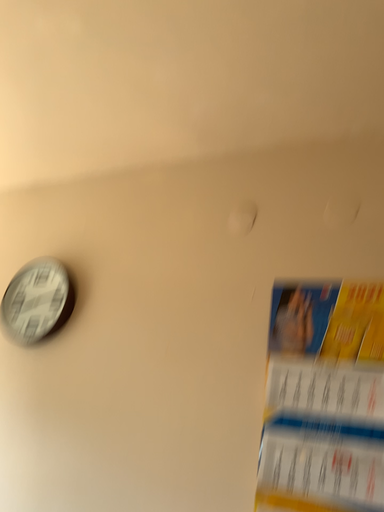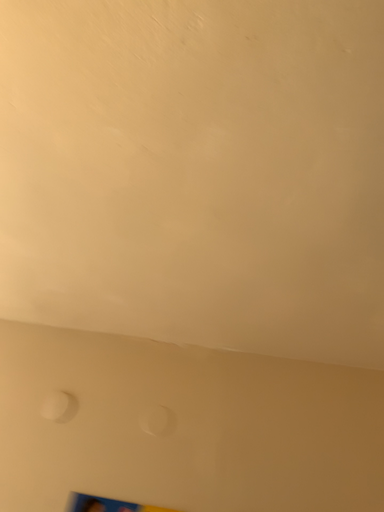
Question: How did the camera likely rotate when shooting the video?

Choices:
 (A) rotated left
 (B) rotated right

Answer: (B)